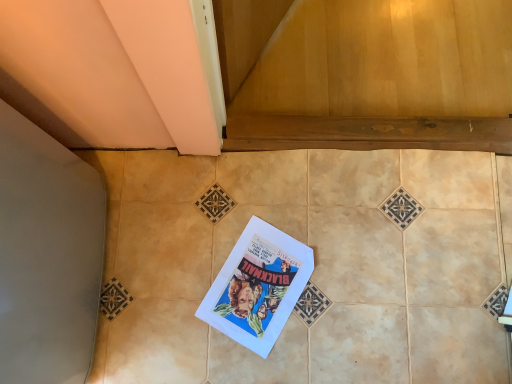
Find the location of `vacant region below white paper comic book at center (from a real-world perspective)`. vacant region below white paper comic book at center (from a real-world perspective) is located at coordinates (261, 287).